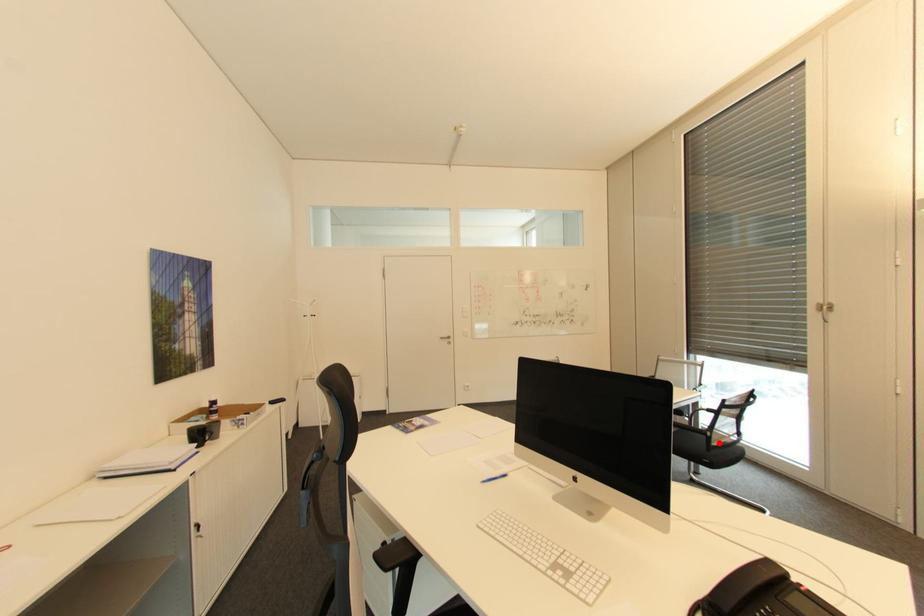
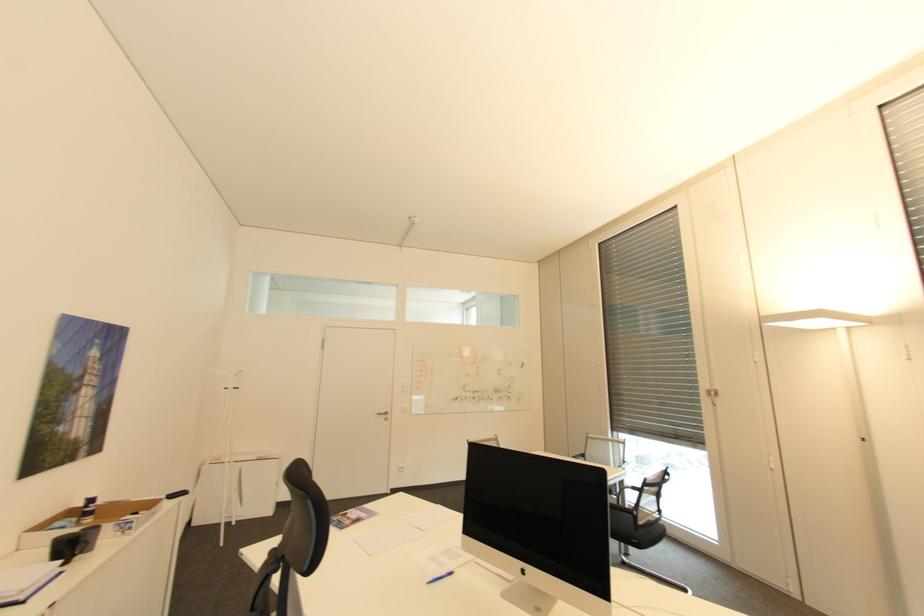
Question: I am providing you with two images of the same scene from different viewpoints. A red point is marked on the first image. Can you still see the location of the red point in image 2?

Choices:
 (A) Yes
 (B) No

Answer: (A)